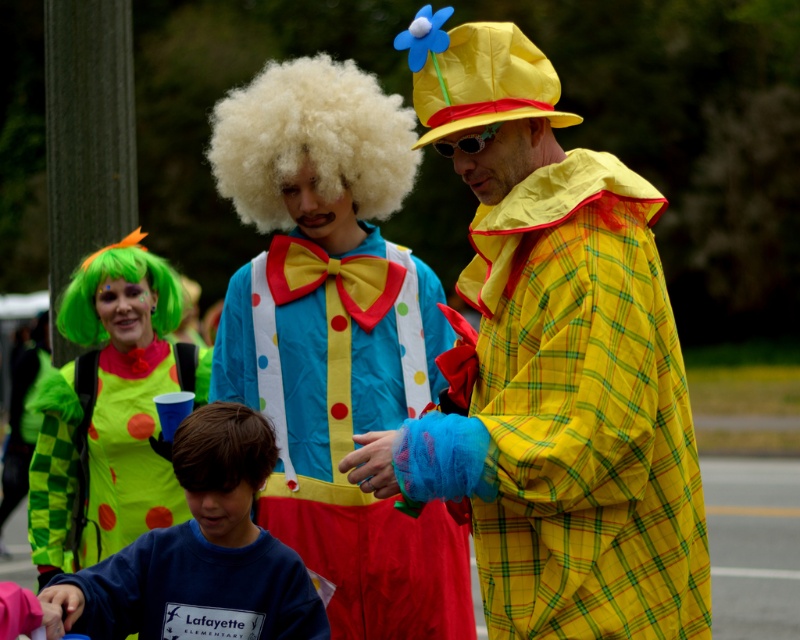
You are a photographer trying to capture a clear photo of both the yellow plaid coat at center and the polka dot fabric clown suit at center. Since you want both to be in focus, which object should you adjust your camera focus on first?

To ensure both the yellow plaid coat at center and the polka dot fabric clown suit at center are in focus, you should focus on the yellow plaid coat at center first because it is closer to the viewer, allowing the depth of field to extend to the farther polka dot fabric clown suit at center.

You are a photographer trying to capture a photo of both the blue cotton sweatshirt at lower left and the green checkered fabric clown costume at left. Since you want them both in the frame, which object should you position your camera closer to?

The green checkered fabric clown costume at left is to the left of the blue cotton sweatshirt at lower left, so positioning the camera closer to the green checkered fabric clown costume at left would ensure both objects are in the frame.

In the lively outdoor scene with two adults and a child dressed in clown costumes, there is a yellow plaid coat at center and a polka dot fabric clown suit at center. Which of these two items is taller?

The yellow plaid coat at center is much taller than the polka dot fabric clown suit at center.